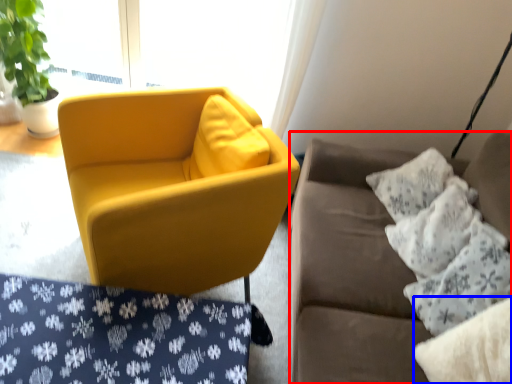
Question: Which object is further to the camera taking this photo, studio couch (highlighted by a red box) or pillow (highlighted by a blue box)?

Choices:
 (A) studio couch
 (B) pillow

Answer: (B)